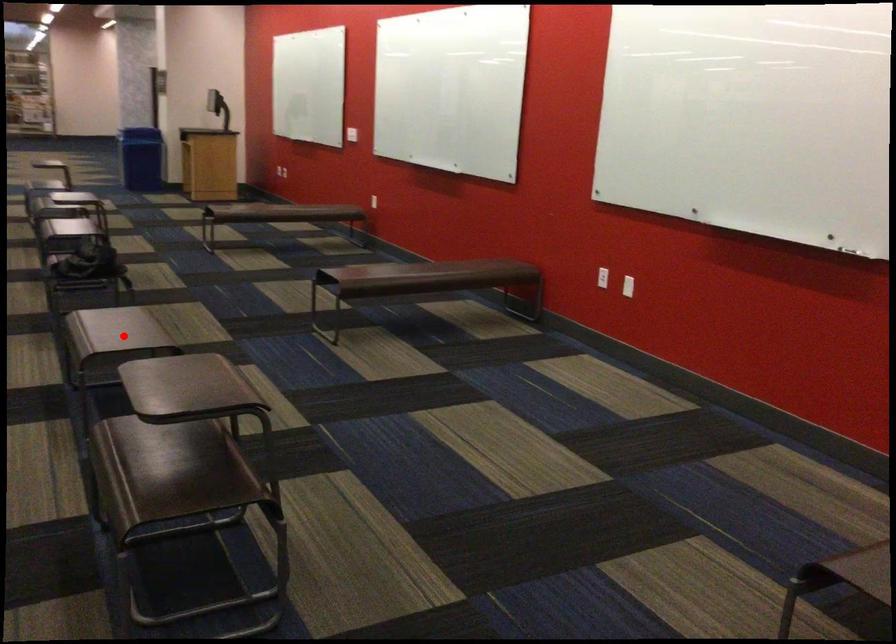
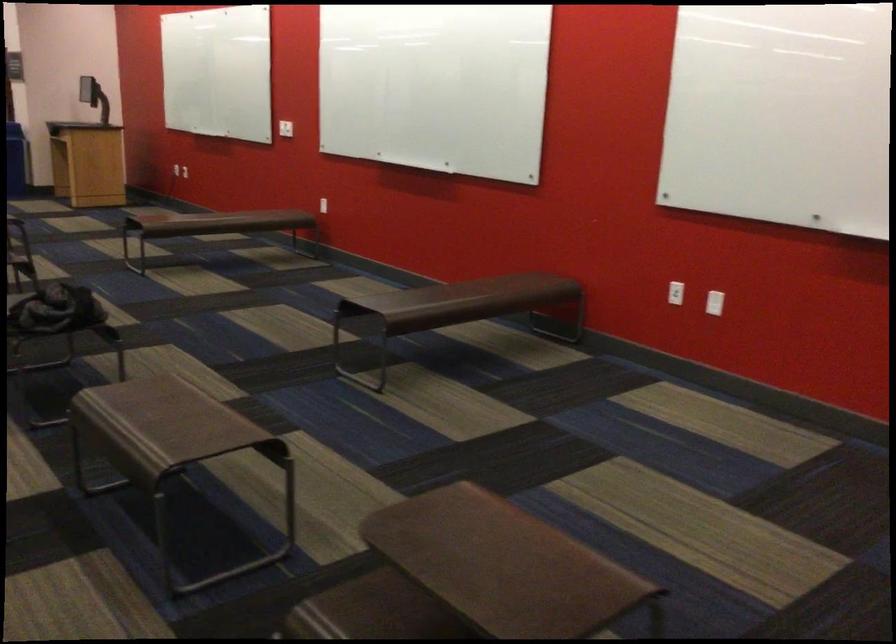
Question: I am providing you with two images of the same scene from different viewpoints. In image1, a red point is highlighted. Considering the same 3D point in image2, which of the following is correct?

Choices:
 (A) It is closer
 (B) It is farther

Answer: (A)